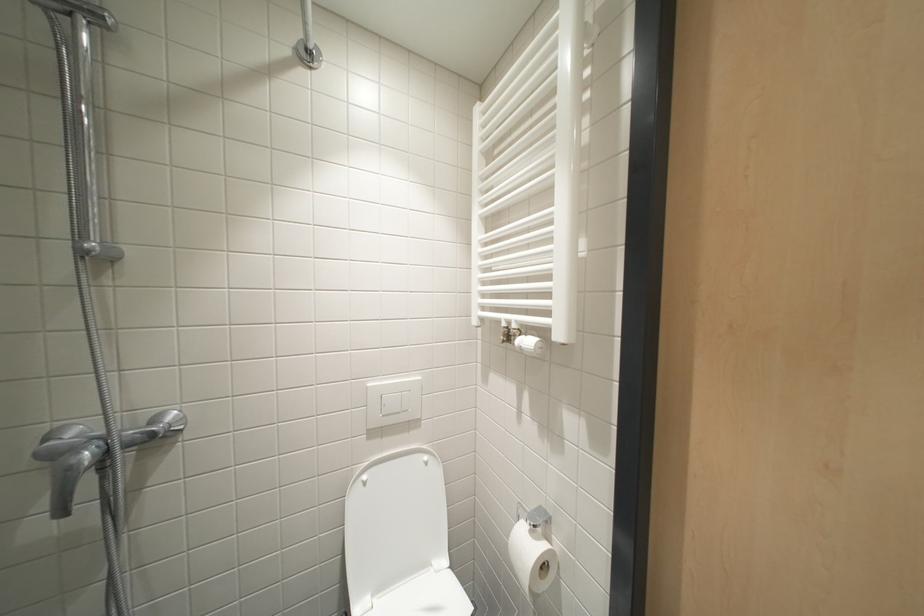
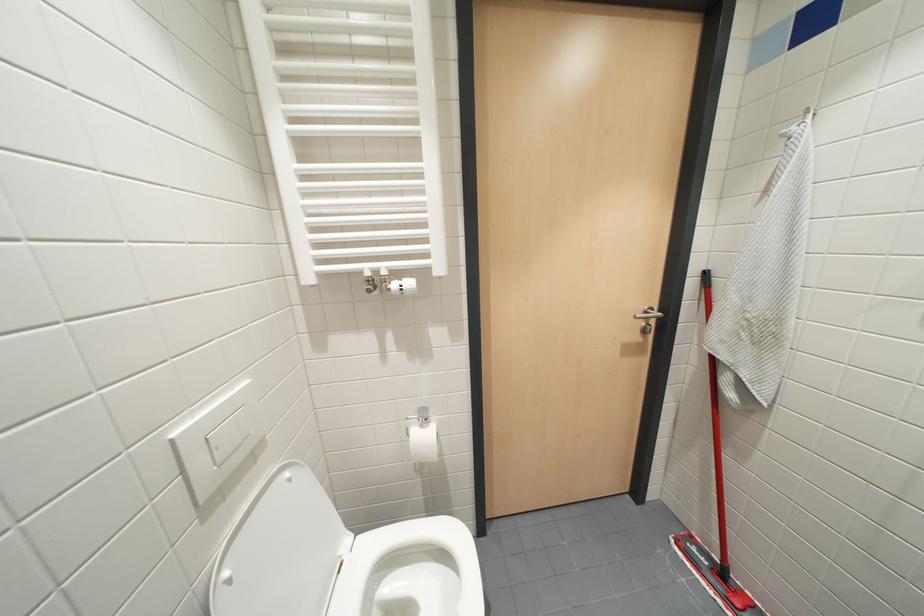
Question: The images are taken continuously from a first-person perspective. In which direction is your viewpoint rotating?

Choices:
 (A) Left
 (B) Right
 (C) Up
 (D) Down

Answer: (B)